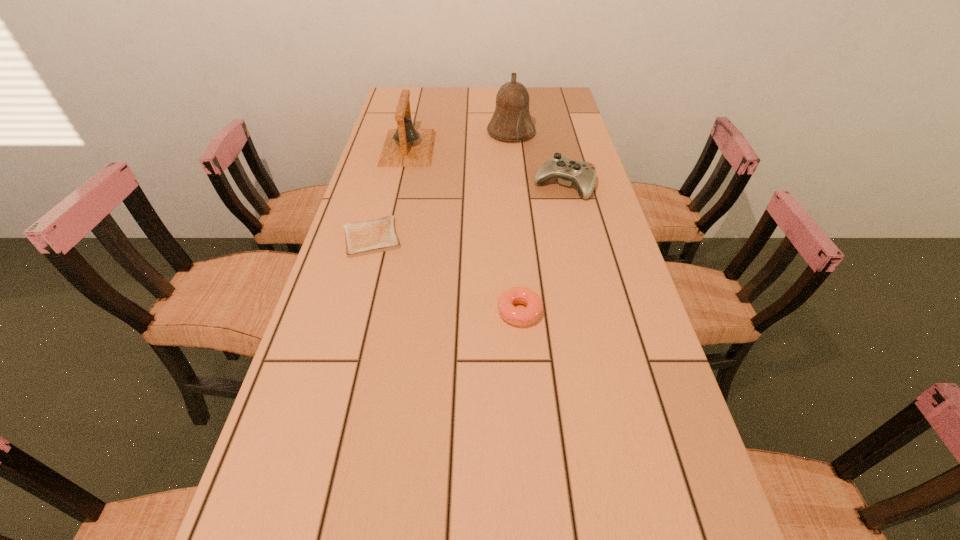
You are a GUI agent. You are given a task and a screenshot of the screen. Output one action in this format:
    pyautogui.click(x=<x>, y=<y>)
    Task: Click on the vacant space in between the taller bell and the fourth shortest object
    
    Given the screenshot: What is the action you would take?
    pyautogui.click(x=460, y=141)

Where is `free space that is in between the tallest object and the shorter bell`? free space that is in between the tallest object and the shorter bell is located at coordinates (460, 141).

I want to click on object identified as the fourth closest to the third tallest object, so click(x=363, y=238).

Identify which object is the third closest to the tallest object. Please provide its 2D coordinates. Your answer should be formatted as a tuple, i.e. [(x, y)], where the tuple contains the x and y coordinates of a point satisfying the conditions above.

[(363, 238)]

This screenshot has height=540, width=960. In order to click on blank area in the image that satisfies the following two spatial constraints: 1. on the front side of the fourth shortest object; 2. on the left side of the control in this screenshot , I will do `click(399, 186)`.

Identify the location of free location that satisfies the following two spatial constraints: 1. on the back side of the nearest object; 2. on the left side of the control. (509, 186).

The height and width of the screenshot is (540, 960). In order to click on vacant space that satisfies the following two spatial constraints: 1. on the back side of the doughnut; 2. on the right side of the third nearest object in this screenshot , I will do `click(509, 186)`.

Image resolution: width=960 pixels, height=540 pixels. What are the coordinates of `free space that satisfies the following two spatial constraints: 1. on the back side of the shortest object; 2. on the right side of the left bell` in the screenshot? It's located at (396, 148).

You are a GUI agent. You are given a task and a screenshot of the screen. Output one action in this format:
    pyautogui.click(x=<x>, y=<y>)
    Task: Click on the vacant space that satisfies the following two spatial constraints: 1. on the back side of the right bell; 2. on the left side of the left bell
    The width and height of the screenshot is (960, 540).
    Given the screenshot: What is the action you would take?
    pyautogui.click(x=412, y=133)

I want to click on free region that satisfies the following two spatial constraints: 1. on the back side of the left bell; 2. on the right side of the second nearest object, so click(x=396, y=148).